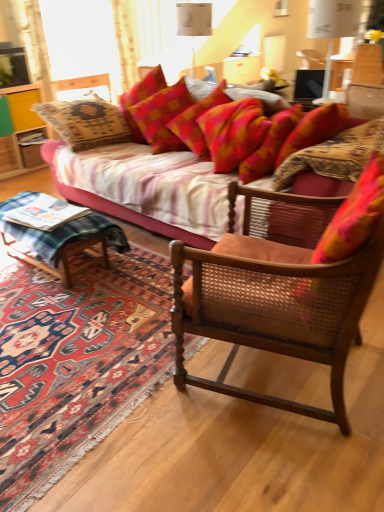
Image resolution: width=384 pixels, height=512 pixels. I want to click on vacant area on top of carpeted rug at lower left (from a real-world perspective), so click(77, 310).